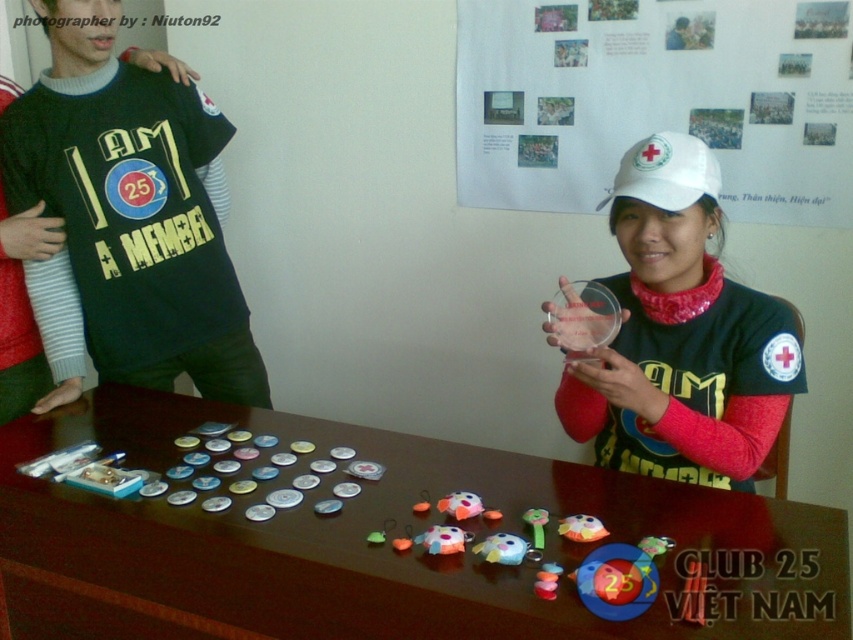
Question: Does matte black t-shirt at left appear on the left side of white matte baseball cap at upper center?

Choices:
 (A) no
 (B) yes

Answer: (B)

Question: Which of the following is the farthest from the observer?

Choices:
 (A) (695, 177)
 (B) (685, 301)
 (C) (76, 321)

Answer: (C)

Question: Which point appears closest to the camera in this image?

Choices:
 (A) (640, 294)
 (B) (547, 84)
 (C) (405, 468)

Answer: (C)

Question: Is white matte cap at upper right to the right of matte black t-shirt at left from the viewer's perspective?

Choices:
 (A) yes
 (B) no

Answer: (A)

Question: Does white paper at upper center lie in front of white matte cap at upper right?

Choices:
 (A) no
 (B) yes

Answer: (A)

Question: Which object is positioned farthest from the wooden table at center?

Choices:
 (A) white paper at upper center
 (B) white matte baseball cap at upper center
 (C) matte black t-shirt at left

Answer: (A)